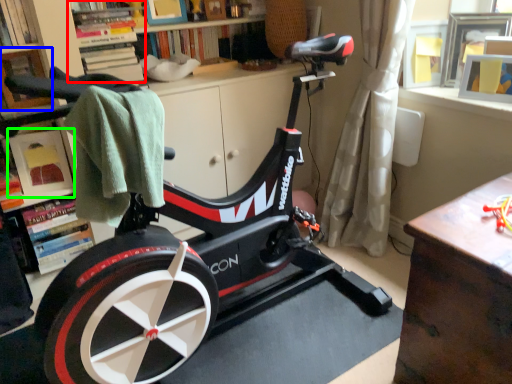
Question: Estimate the real-world distances between objects in this image. Which object is closer to shelf (highlighted by a red box), shelf (highlighted by a blue box) or shelf (highlighted by a green box)?

Choices:
 (A) shelf
 (B) shelf

Answer: (A)